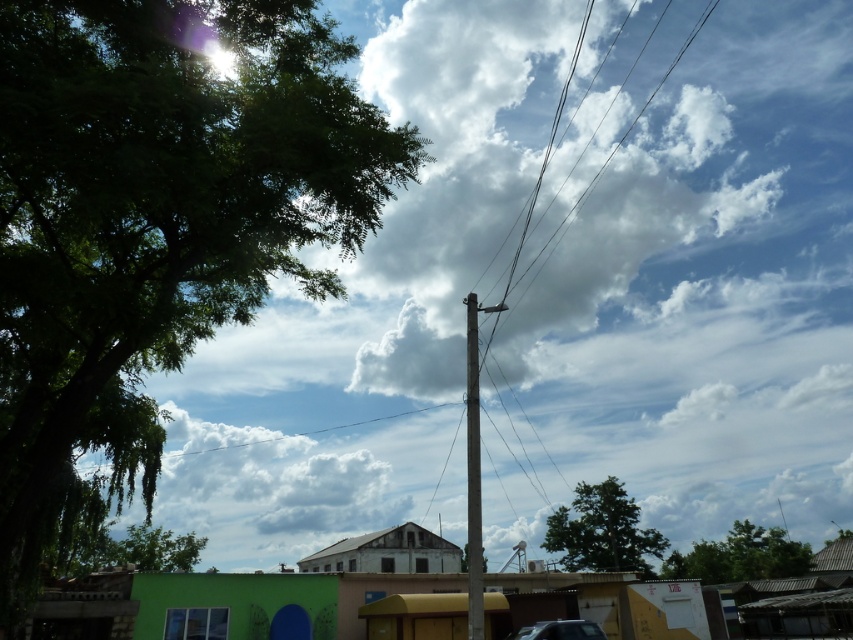
Who is positioned more to the left, gray wooden telegraph pole at center or shiny silver car at bottom center?

Positioned to the left is gray wooden telegraph pole at center.

Consider the image. Does gray wooden telegraph pole at center have a greater width compared to shiny silver car at bottom center?

No, gray wooden telegraph pole at center is not wider than shiny silver car at bottom center.

Is point (477, 465) closer to camera compared to point (529, 637)?

Yes, it is in front of point (529, 637).

Identify the location of gray wooden telegraph pole at center. (473, 477).

Does wire/cable at upper center have a greater height compared to green leafy tree at lower left?

Correct, wire/cable at upper center is much taller as green leafy tree at lower left.

Image resolution: width=853 pixels, height=640 pixels. What do you see at coordinates (605, 160) in the screenshot? I see `wire/cable at upper center` at bounding box center [605, 160].

Where is `wire/cable at upper center`? The width and height of the screenshot is (853, 640). wire/cable at upper center is located at coordinates (605, 160).

Can you confirm if green leafy tree at lower right is taller than wire/cable at upper center?

In fact, green leafy tree at lower right may be shorter than wire/cable at upper center.

In the scene shown: Can you confirm if green leafy tree at lower right is positioned to the right of wire/cable at upper center?

Correct, you'll find green leafy tree at lower right to the right of wire/cable at upper center.

The width and height of the screenshot is (853, 640). Find the location of `green leafy tree at lower right`. green leafy tree at lower right is located at coordinates (740, 556).

Locate an element on the screen. green leafy tree at lower right is located at coordinates (740, 556).